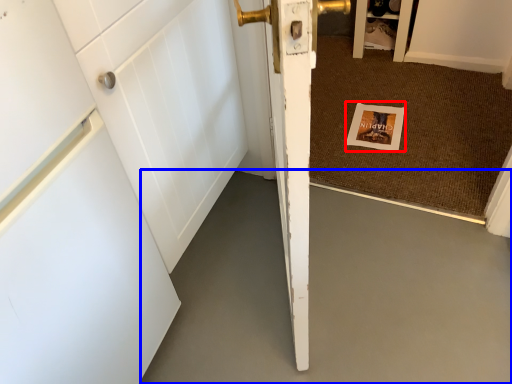
Question: Among these objects, which one is nearest to the camera, postcard (highlighted by a red box) or concrete (highlighted by a blue box)?

Choices:
 (A) postcard
 (B) concrete

Answer: (B)